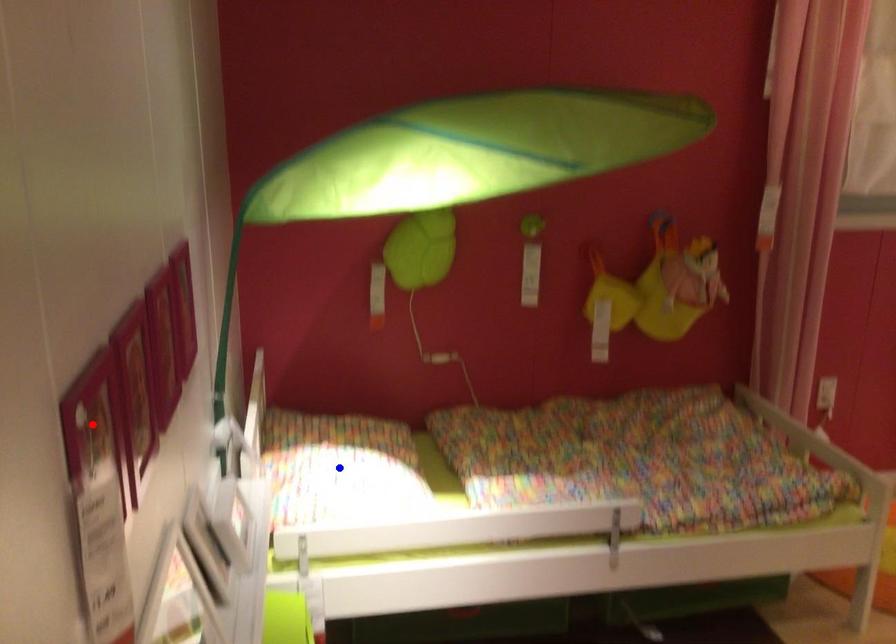
Question: In the image, two points are highlighted. Which point is nearer to the camera? Reply with the corresponding letter.

Choices:
 (A) blue point
 (B) red point

Answer: (B)